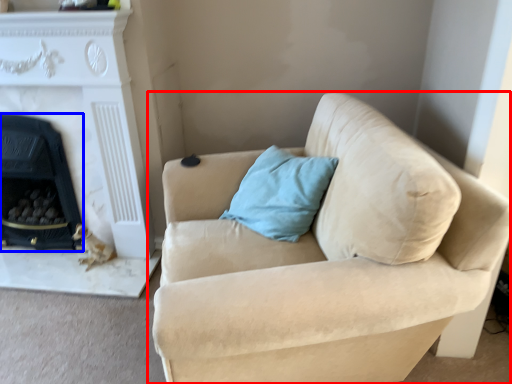
Question: Which object is closer to the camera taking this photo, studio couch (highlighted by a red box) or fireplace (highlighted by a blue box)?

Choices:
 (A) studio couch
 (B) fireplace

Answer: (A)